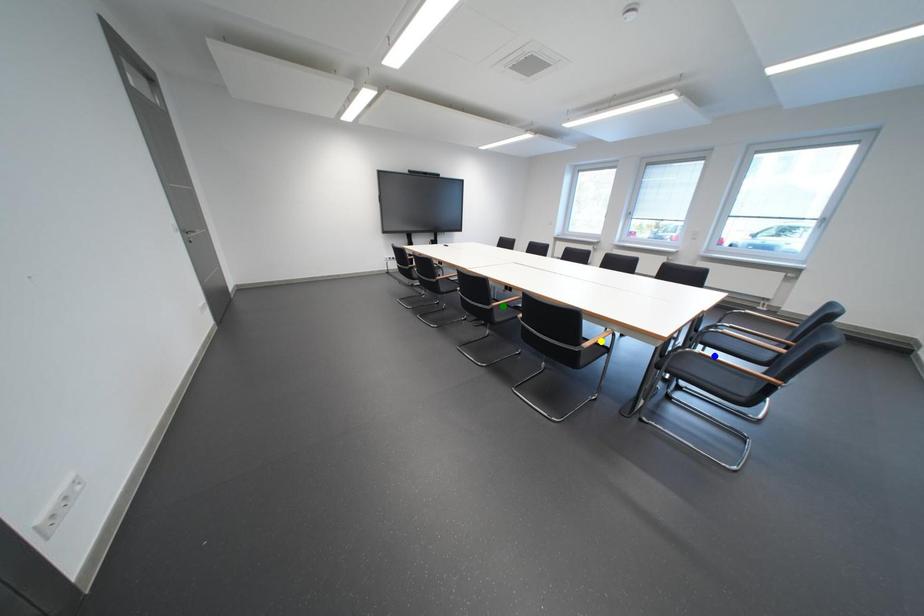
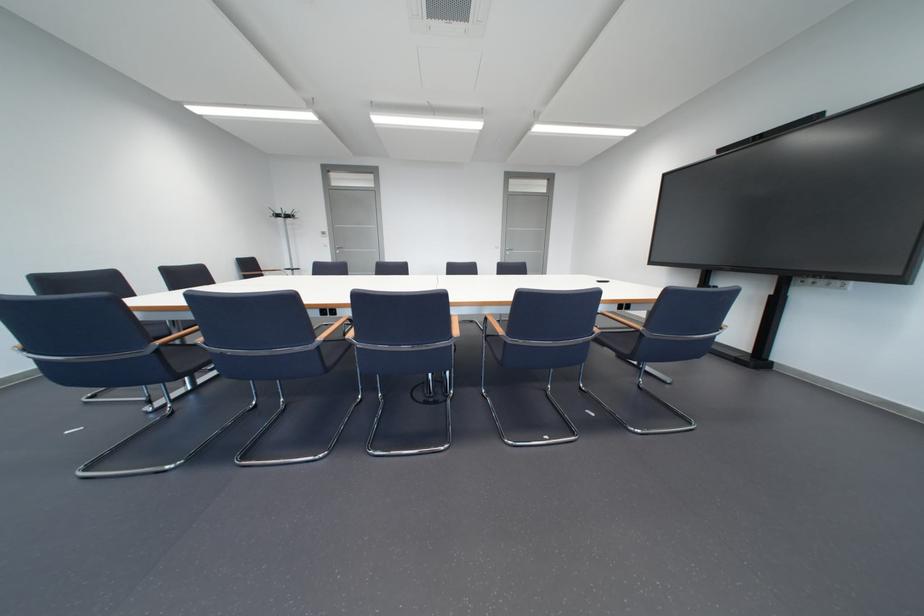
I am providing you with two images of the same scene from different viewpoints. Three points are marked in image1. Which point corresponds to a part or object that is occluded in image2?In image1, three points are marked. Which of them correspond to a part or object that is occluded in image2?Among the three points shown in image1, which one corresponds to a part or object that is no longer visible due to occlusion in image2?

blue point, green point, yellow point